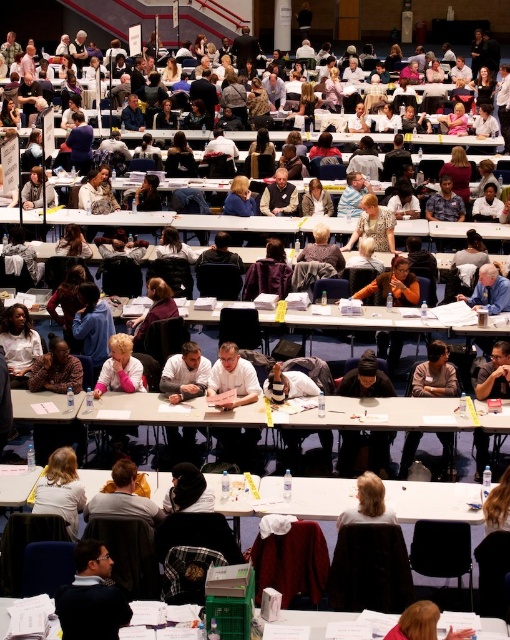
Between point (316, 611) and point (424, 628), which one is positioned in front?

Point (424, 628) is in front.

The height and width of the screenshot is (640, 510). In order to click on white paper at lower center in this screenshot , I will do `click(314, 620)`.

Is blonde hair at lower left wider than white paper at lower center?

No, blonde hair at lower left is not wider than white paper at lower center.

Between point (55, 465) and point (291, 612), which one is positioned behind?

Point (55, 465)

The image size is (510, 640). Identify the location of blonde hair at lower left. click(x=61, y=490).

You are a GUI agent. You are given a task and a screenshot of the screen. Output one action in this format:
    pyautogui.click(x=<x>, y=<y>)
    Task: Click on the blonde hair at lower left
    The height and width of the screenshot is (640, 510).
    Given the screenshot: What is the action you would take?
    pyautogui.click(x=61, y=490)

Can you confirm if white plastic table at center is positioned above dark blue sweater at lower left?

Correct, white plastic table at center is located above dark blue sweater at lower left.

Which of these two, white plastic table at center or dark blue sweater at lower left, stands taller?

Standing taller between the two is dark blue sweater at lower left.

Is point (197, 410) less distant than point (102, 609)?

No, (197, 410) is behind (102, 609).

I want to click on white plastic table at center, so click(133, 410).